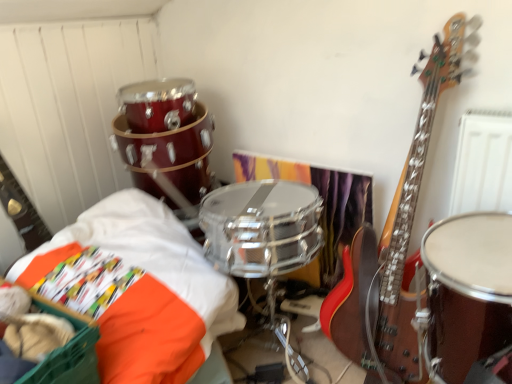
Question: Is orange fabric basket at lower left thinner than orange fabric at lower left?

Choices:
 (A) no
 (B) yes

Answer: (B)

Question: Does orange fabric basket at lower left contain orange fabric at lower left?

Choices:
 (A) no
 (B) yes

Answer: (A)

Question: Are orange fabric basket at lower left and orange fabric at lower left making contact?

Choices:
 (A) yes
 (B) no

Answer: (B)

Question: Considering the relative sizes of orange fabric basket at lower left and orange fabric at lower left in the image provided, is orange fabric basket at lower left bigger than orange fabric at lower left?

Choices:
 (A) yes
 (B) no

Answer: (B)

Question: Considering the relative sizes of orange fabric basket at lower left and orange fabric at lower left in the image provided, is orange fabric basket at lower left shorter than orange fabric at lower left?

Choices:
 (A) yes
 (B) no

Answer: (A)

Question: Do you think orange fabric at lower left is within orange fabric basket at lower left, or outside of it?

Choices:
 (A) outside
 (B) inside

Answer: (A)

Question: Is orange fabric at lower left wider or thinner than orange fabric basket at lower left?

Choices:
 (A) wide
 (B) thin

Answer: (A)

Question: From the image's perspective, is orange fabric at lower left located above or below orange fabric basket at lower left?

Choices:
 (A) above
 (B) below

Answer: (A)

Question: Is orange fabric at lower left taller or shorter than orange fabric basket at lower left?

Choices:
 (A) tall
 (B) short

Answer: (A)

Question: Which is correct: orange fabric basket at lower left is inside orange fabric at lower left, or outside of it?

Choices:
 (A) outside
 (B) inside

Answer: (B)

Question: From a real-world perspective, is orange fabric basket at lower left above or below orange fabric at lower left?

Choices:
 (A) above
 (B) below

Answer: (A)

Question: Considering their positions, is orange fabric basket at lower left located in front of or behind orange fabric at lower left?

Choices:
 (A) front
 (B) behind

Answer: (A)

Question: Considering the positions of orange fabric basket at lower left and orange fabric at lower left in the image, is orange fabric basket at lower left wider or thinner than orange fabric at lower left?

Choices:
 (A) wide
 (B) thin

Answer: (B)

Question: From the image's perspective, is shiny brown drum at right positioned above or below orange fabric basket at lower left?

Choices:
 (A) below
 (B) above

Answer: (B)

Question: Based on their sizes in the image, would you say shiny brown drum at right is bigger or smaller than orange fabric basket at lower left?

Choices:
 (A) small
 (B) big

Answer: (B)